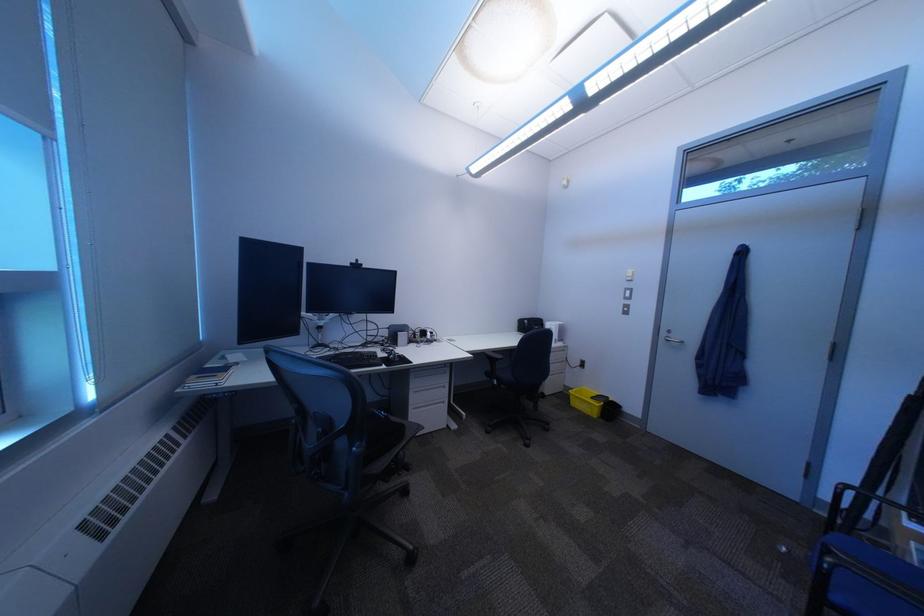
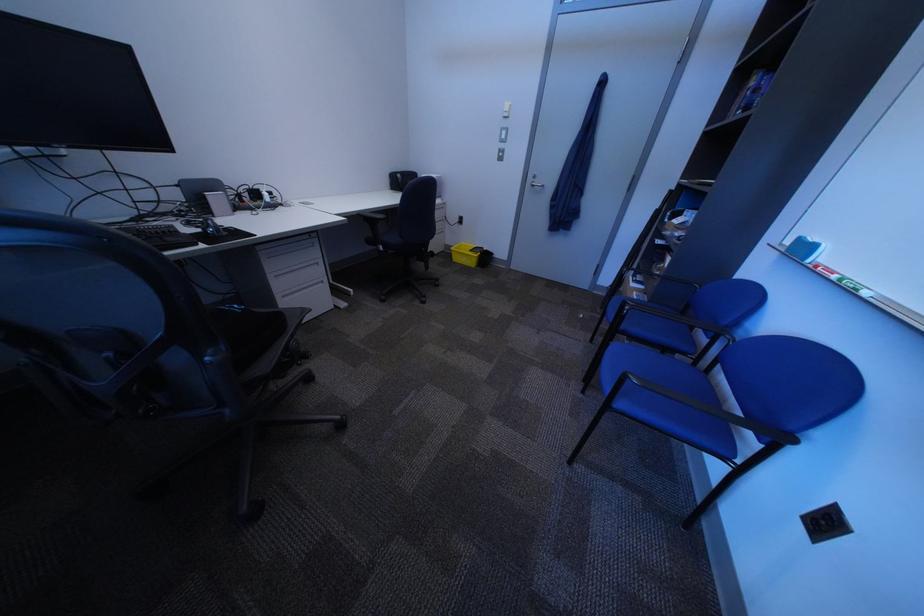
How did the camera likely rotate?

The camera's rotation is toward right-down.